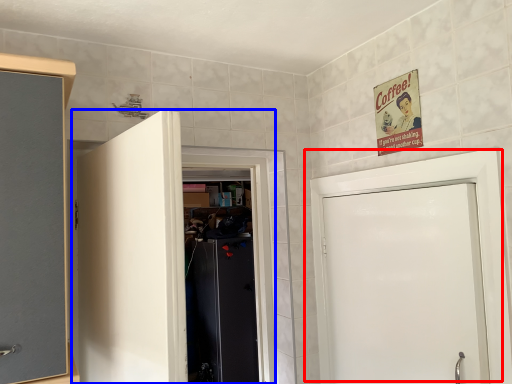
Question: Which object appears closest to the camera in this image, door (highlighted by a red box) or door (highlighted by a blue box)?

Choices:
 (A) door
 (B) door

Answer: (B)